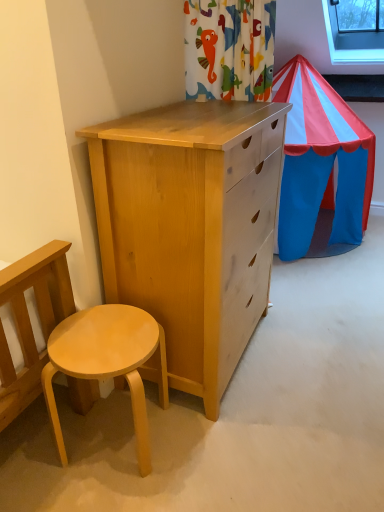
In order to face light wood stool at lower left, should I rotate leftwards or rightwards?

Turn left by 10.304 degrees to look at light wood stool at lower left.

Find the location of a particular element. The height and width of the screenshot is (512, 384). light wood stool at lower left is located at coordinates (107, 362).

What do you see at coordinates (107, 362) in the screenshot? The height and width of the screenshot is (512, 384). I see `light wood stool at lower left` at bounding box center [107, 362].

What do you see at coordinates (350, 49) in the screenshot? Image resolution: width=384 pixels, height=512 pixels. I see `transparent glass window at upper right` at bounding box center [350, 49].

Find the location of a particular element. The height and width of the screenshot is (512, 384). transparent glass window at upper right is located at coordinates (350, 49).

This screenshot has width=384, height=512. What are the coordinates of `light wood stool at lower left` in the screenshot? It's located at (107, 362).

Considering the positions of objects light wood stool at lower left and transparent glass window at upper right in the image provided, who is more to the right, light wood stool at lower left or transparent glass window at upper right?

transparent glass window at upper right is more to the right.

Is light wood stool at lower left further to camera compared to transparent glass window at upper right?

No, the depth of light wood stool at lower left is less than that of transparent glass window at upper right.

Considering the positions of point (144, 454) and point (338, 61), is point (144, 454) closer or farther from the camera than point (338, 61)?

Clearly, point (144, 454) is closer to the camera than point (338, 61).

From the image's perspective, is light wood stool at lower left positioned above or below transparent glass window at upper right?

light wood stool at lower left is situated lower than transparent glass window at upper right in the image.

From a real-world perspective, which is physically below, light wood stool at lower left or transparent glass window at upper right?

light wood stool at lower left is physically lower.

Does light wood stool at lower left have a lesser width compared to transparent glass window at upper right?

Yes.

Looking at this image, does light wood stool at lower left have a lesser height compared to transparent glass window at upper right?

In fact, light wood stool at lower left may be taller than transparent glass window at upper right.

Considering the relative sizes of light wood stool at lower left and transparent glass window at upper right in the image provided, is light wood stool at lower left bigger than transparent glass window at upper right?

No, light wood stool at lower left is not bigger than transparent glass window at upper right.

Based on the photo, is light wood stool at lower left not within transparent glass window at upper right?

Yes, light wood stool at lower left is located beyond the bounds of transparent glass window at upper right.

Are light wood stool at lower left and transparent glass window at upper right located far from each other?

Yes, light wood stool at lower left and transparent glass window at upper right are located far from each other.

Could you tell me if light wood stool at lower left is turned towards transparent glass window at upper right?

No, light wood stool at lower left is not turned towards transparent glass window at upper right.

How different are the orientations of light wood stool at lower left and transparent glass window at upper right in degrees?

They differ by 9.17 degrees in their facing directions.

How much distance is there between light wood stool at lower left and transparent glass window at upper right?

They are 2.40 meters apart.

Where is `desk that appears in front of the transparent glass window at upper right`? The width and height of the screenshot is (384, 512). desk that appears in front of the transparent glass window at upper right is located at coordinates (107, 362).

Between transparent glass window at upper right and light wood stool at lower left, which one appears on the right side from the viewer's perspective?

transparent glass window at upper right is more to the right.

Between transparent glass window at upper right and light wood stool at lower left, which one is positioned behind?

transparent glass window at upper right is more distant.

Does point (327, 34) come behind point (90, 374)?

Yes.

From the image's perspective, is transparent glass window at upper right positioned above or below light wood stool at lower left?

transparent glass window at upper right is above light wood stool at lower left.

From a real-world perspective, between transparent glass window at upper right and light wood stool at lower left, who is vertically lower?

light wood stool at lower left.

Looking at their sizes, would you say transparent glass window at upper right is wider or thinner than light wood stool at lower left?

Considering their sizes, transparent glass window at upper right looks broader than light wood stool at lower left.

From the picture: Between transparent glass window at upper right and light wood stool at lower left, which one has more height?

Standing taller between the two is light wood stool at lower left.

Is transparent glass window at upper right bigger than light wood stool at lower left?

Correct, transparent glass window at upper right is larger in size than light wood stool at lower left.

Which is correct: transparent glass window at upper right is inside light wood stool at lower left, or outside of it?

transparent glass window at upper right is outside light wood stool at lower left.

Is transparent glass window at upper right not close to light wood stool at lower left?

Yes, transparent glass window at upper right and light wood stool at lower left are quite far apart.

Is transparent glass window at upper right aimed at light wood stool at lower left?

No, transparent glass window at upper right is not turned towards light wood stool at lower left.

How different are the orientations of transparent glass window at upper right and light wood stool at lower left in degrees?

They differ by 9.17 degrees in their facing directions.

Image resolution: width=384 pixels, height=512 pixels. I want to click on window screen that appears on the right of light wood stool at lower left, so click(x=350, y=49).

This screenshot has width=384, height=512. What are the coordinates of `window screen on the right of the light wood stool at lower left` in the screenshot? It's located at (350, 49).

At what (x,y) coordinates should I click in order to perform the action: click on desk below the transparent glass window at upper right (from a real-world perspective). Please return your answer as a coordinate pair (x, y). Image resolution: width=384 pixels, height=512 pixels. Looking at the image, I should click on (107, 362).